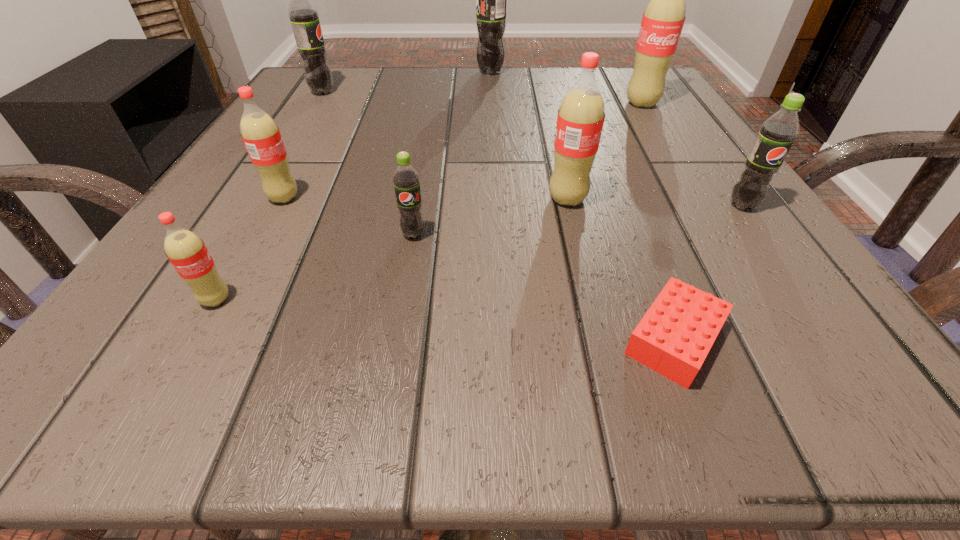
Where is `vacant space that's between the third soda from right to left and the farthest red soda`? The image size is (960, 540). vacant space that's between the third soda from right to left and the farthest red soda is located at coordinates (605, 151).

Where is `vacant region between the third soda from right to left and the farthest soda`? This screenshot has width=960, height=540. vacant region between the third soda from right to left and the farthest soda is located at coordinates (529, 136).

You are a GUI agent. You are given a task and a screenshot of the screen. Output one action in this format:
    pyautogui.click(x=<x>, y=<y>)
    Task: Click on the vacant area between the shortest object and the seventh farthest soda
    
    Given the screenshot: What is the action you would take?
    pyautogui.click(x=544, y=287)

What are the coordinates of `free point between the second nearest green soda and the seventh farthest soda` in the screenshot? It's located at [578, 220].

Where is `vacant point located between the second nearest green soda and the third biggest red soda`? This screenshot has height=540, width=960. vacant point located between the second nearest green soda and the third biggest red soda is located at coordinates (513, 202).

I want to click on free point between the second smallest green soda and the second farthest green soda, so click(532, 149).

Find the location of a particular element. The image size is (960, 540). unoccupied area between the biggest red soda and the fourth soda from right to left is located at coordinates (566, 87).

I want to click on vacant space that is in between the second biggest red soda and the nearest soda, so click(x=392, y=249).

Where is `object that is the fifth closest to the shortest object`? This screenshot has width=960, height=540. object that is the fifth closest to the shortest object is located at coordinates (261, 136).

Find the location of a particular element. The width and height of the screenshot is (960, 540). object that stands as the sixth closest to the third green soda from left to right is located at coordinates click(x=777, y=133).